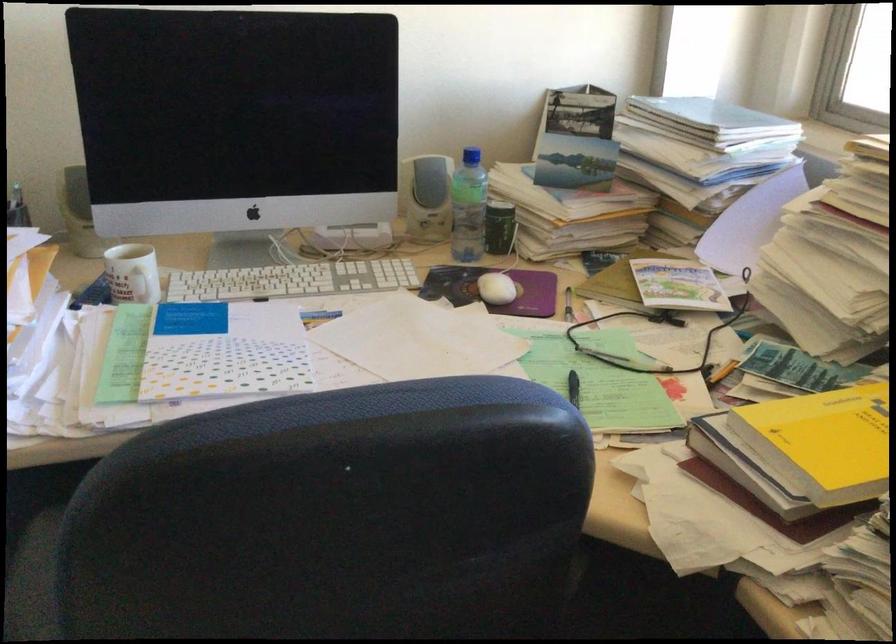
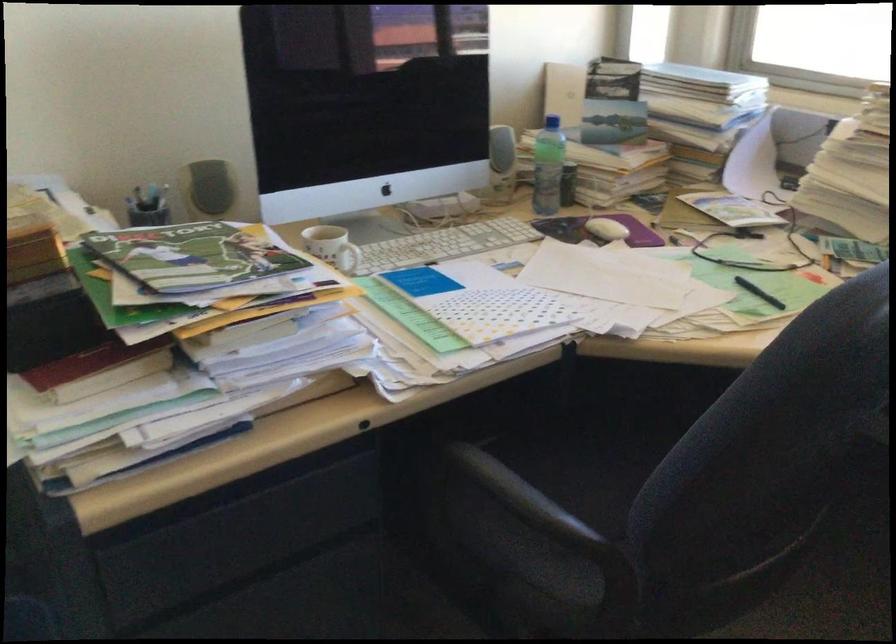
Question: Based on the continuous images, in which direction is the camera rotating? Reply with the corresponding letter.

Choices:
 (A) Left
 (B) Right
 (C) Up
 (D) Down

Answer: (B)